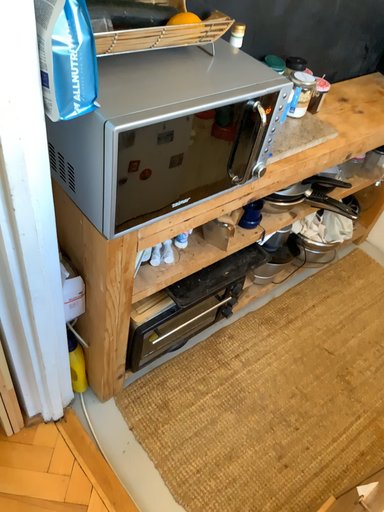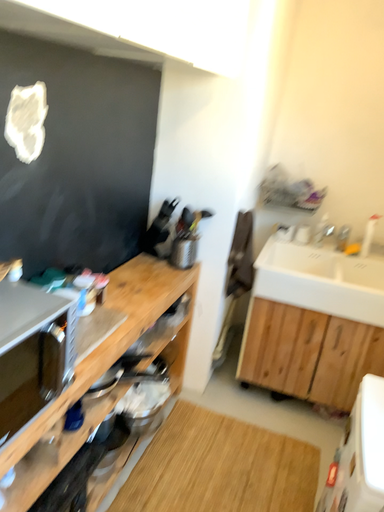
Question: How did the camera likely rotate when shooting the video?

Choices:
 (A) rotated left
 (B) rotated right

Answer: (B)